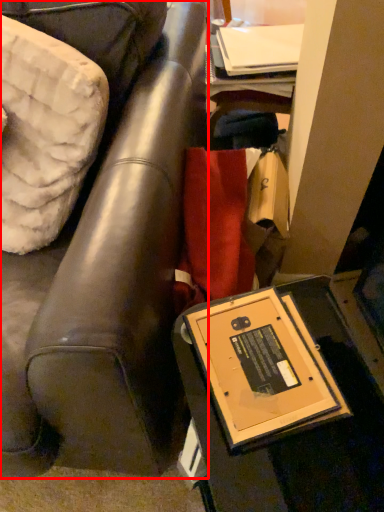
Question: From the image's perspective, considering the relative positions of furniture (annotated by the red box) and table in the image provided, where is furniture (annotated by the red box) located with respect to the staircase?

Choices:
 (A) above
 (B) below

Answer: (A)